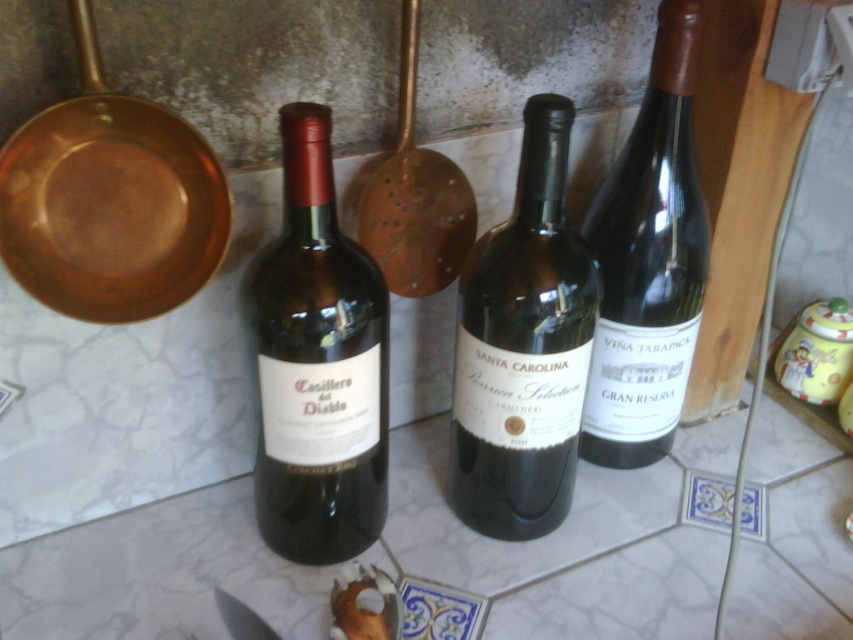
In the scene shown: Is matte dark brown bottle at center closer to the viewer compared to dark green glass bottle at center?

Yes, matte dark brown bottle at center is in front of dark green glass bottle at center.

Does matte dark brown bottle at center have a lesser width compared to dark green glass bottle at center?

No, matte dark brown bottle at center is not thinner than dark green glass bottle at center.

Does point (340, 404) come farther from viewer compared to point (543, 196)?

That is True.

You are a GUI agent. You are given a task and a screenshot of the screen. Output one action in this format:
    pyautogui.click(x=<x>, y=<y>)
    Task: Click on the matte dark brown bottle at center
    
    Given the screenshot: What is the action you would take?
    pyautogui.click(x=317, y=364)

Is point (554, 308) closer to camera compared to point (225, 600)?

Yes, it is in front of point (225, 600).

Which is in front, point (554, 228) or point (227, 596)?

Positioned in front is point (554, 228).

Does point (461, 275) come farther from viewer compared to point (215, 586)?

Yes, it is behind point (215, 586).

This screenshot has width=853, height=640. What are the coordinates of `dark green glass bottle at center` in the screenshot? It's located at (523, 348).

Does dark brown glass bottle at center have a greater width compared to matte silver knife at lower left?

Indeed, dark brown glass bottle at center has a greater width compared to matte silver knife at lower left.

Can you confirm if dark brown glass bottle at center is positioned to the left of matte silver knife at lower left?

No, dark brown glass bottle at center is not to the left of matte silver knife at lower left.

Who is more distant from viewer, (x=665, y=0) or (x=247, y=624)?

Positioned behind is point (x=247, y=624).

Image resolution: width=853 pixels, height=640 pixels. In order to click on dark brown glass bottle at center in this screenshot , I will do `click(648, 260)`.